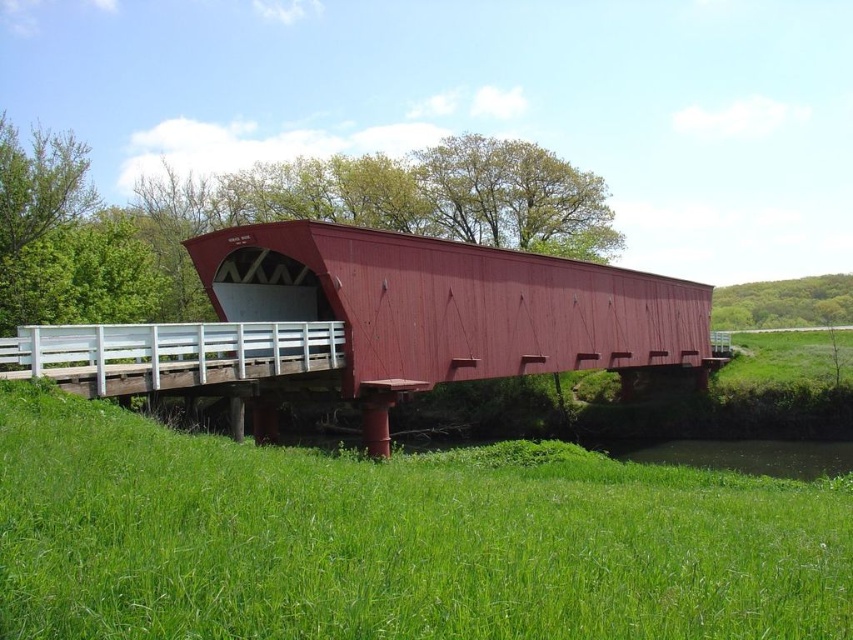
Question: Can you confirm if green grassy at lower center is positioned below matte red bridge at center?

Choices:
 (A) no
 (B) yes

Answer: (B)

Question: Is green grassy at lower center smaller than matte red bridge at center?

Choices:
 (A) yes
 (B) no

Answer: (A)

Question: Does green grassy at lower center have a smaller size compared to matte red bridge at center?

Choices:
 (A) yes
 (B) no

Answer: (A)

Question: Among these objects, which one is nearest to the camera?

Choices:
 (A) matte red bridge at center
 (B) green grassy at lower center

Answer: (B)